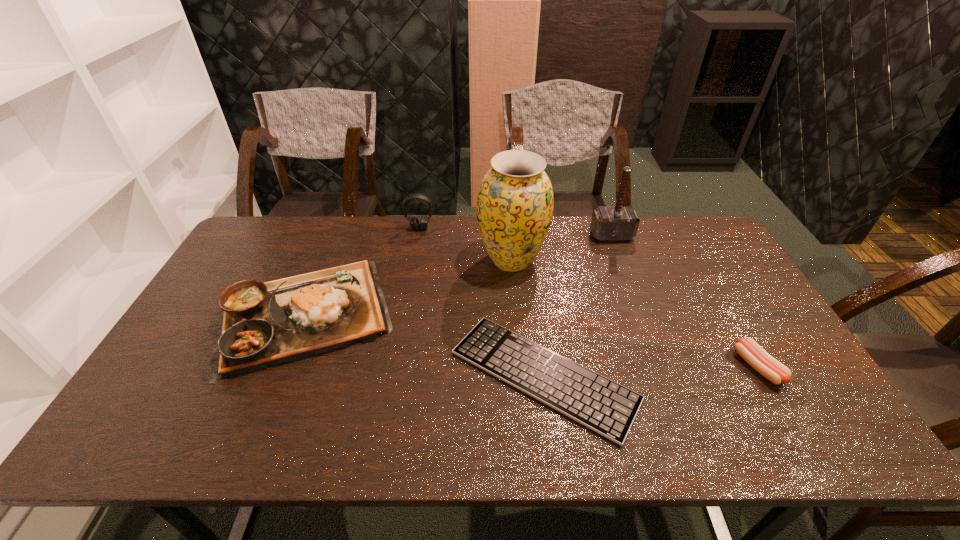
Where is `vacant point at the near edge`? This screenshot has width=960, height=540. vacant point at the near edge is located at coordinates (306, 436).

Locate an element on the screen. This screenshot has height=540, width=960. free space at the left edge is located at coordinates (258, 276).

The width and height of the screenshot is (960, 540). What are the coordinates of `vacant area at the right edge` in the screenshot? It's located at (773, 345).

Locate an element on the screen. vacant space at the near left corner is located at coordinates (166, 429).

You are a GUI agent. You are given a task and a screenshot of the screen. Output one action in this format:
    pyautogui.click(x=<x>, y=<y>)
    Task: Click on the free space between the headset and the tallest object
    Image resolution: width=960 pixels, height=540 pixels.
    Given the screenshot: What is the action you would take?
    pyautogui.click(x=466, y=244)

This screenshot has width=960, height=540. What are the coordinates of `free space between the hammer and the fourth tallest object` in the screenshot? It's located at (457, 275).

Where is `free point between the sausage and the fifth shortest object`? free point between the sausage and the fifth shortest object is located at coordinates (684, 301).

You are a GUI agent. You are given a task and a screenshot of the screen. Output one action in this format:
    pyautogui.click(x=<x>, y=<y>)
    Task: Click on the free space between the fifth shortest object and the computer keyboard
    
    Given the screenshot: What is the action you would take?
    pyautogui.click(x=578, y=306)

What are the coordinates of `free space between the second tallest object and the shortest object` in the screenshot? It's located at (578, 306).

Identify the location of blank region between the second tallest object and the fifth tallest object. (684, 301).